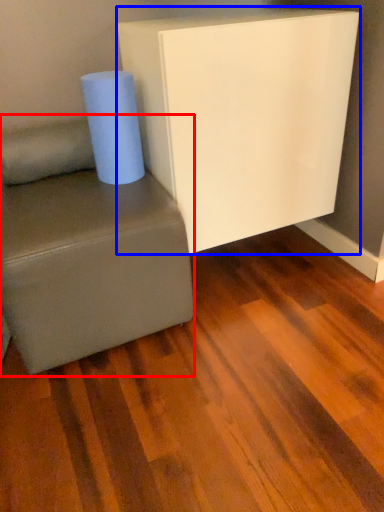
Question: Among these objects, which one is nearest to the camera, studio couch (highlighted by a red box) or furniture (highlighted by a blue box)?

Choices:
 (A) studio couch
 (B) furniture

Answer: (A)